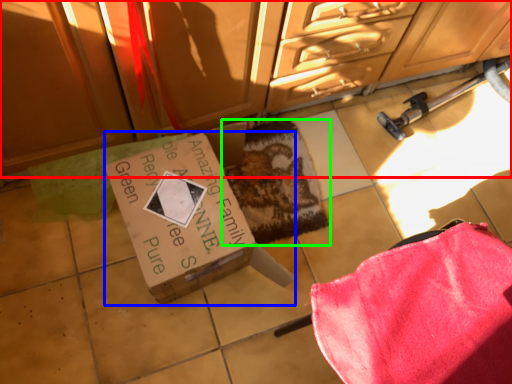
Question: Which object is the closest to the cabinetry (highlighted by a red box)? Choose among these: box (highlighted by a blue box) or mat (highlighted by a green box).

Choices:
 (A) box
 (B) mat

Answer: (B)